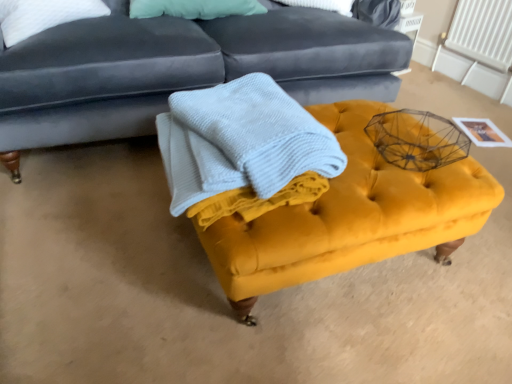
Image resolution: width=512 pixels, height=384 pixels. Find the location of `blank area beneath white plastic radiator at upper right (from a real-world perspective)`. blank area beneath white plastic radiator at upper right (from a real-world perspective) is located at coordinates coord(462,82).